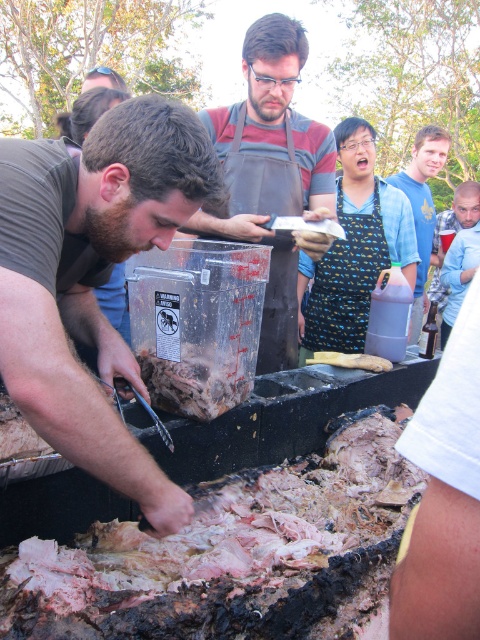
Is matte black meat at lower left smaller than yellowish matte wood at center?

No.

Does matte black meat at lower left have a lesser height compared to yellowish matte wood at center?

No, matte black meat at lower left is not shorter than yellowish matte wood at center.

Locate an element on the screen. The width and height of the screenshot is (480, 640). matte black meat at lower left is located at coordinates (93, 276).

Identify the location of matte black meat at lower left. Image resolution: width=480 pixels, height=640 pixels. [x=93, y=276].

Between matte black meat at lower left and brown meat at center, which one has less height?

Standing shorter between the two is brown meat at center.

This screenshot has width=480, height=640. What do you see at coordinates (93, 276) in the screenshot?
I see `matte black meat at lower left` at bounding box center [93, 276].

The image size is (480, 640). Identify the location of matte black meat at lower left. (93, 276).

Which is in front, point (148, 161) or point (295, 353)?

Point (148, 161)

The image size is (480, 640). What are the coordinates of `matte black meat at lower left` in the screenshot? It's located at (93, 276).